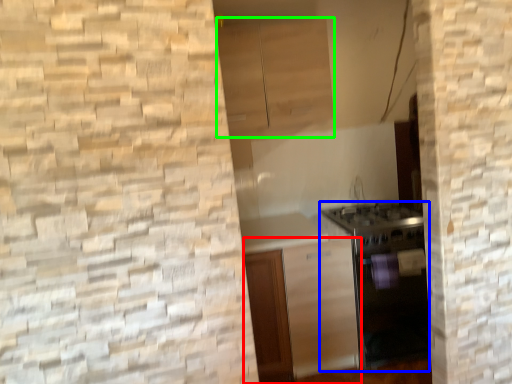
Question: Considering the real-world distances, which object is farthest from cabinetry (highlighted by a red box)? oven (highlighted by a blue box) or cabinetry (highlighted by a green box)?

Choices:
 (A) oven
 (B) cabinetry

Answer: (B)